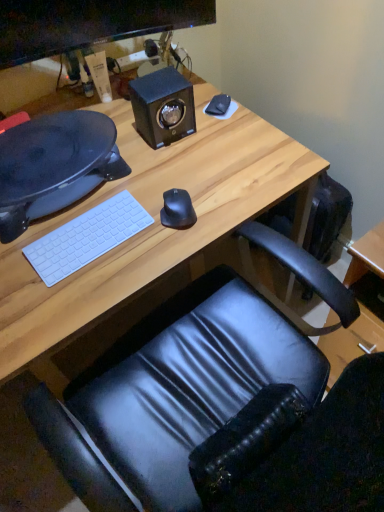
This screenshot has height=512, width=384. I want to click on vacant area that lies between black textured speaker at upper center and white matte keyboard at lower left, so click(129, 179).